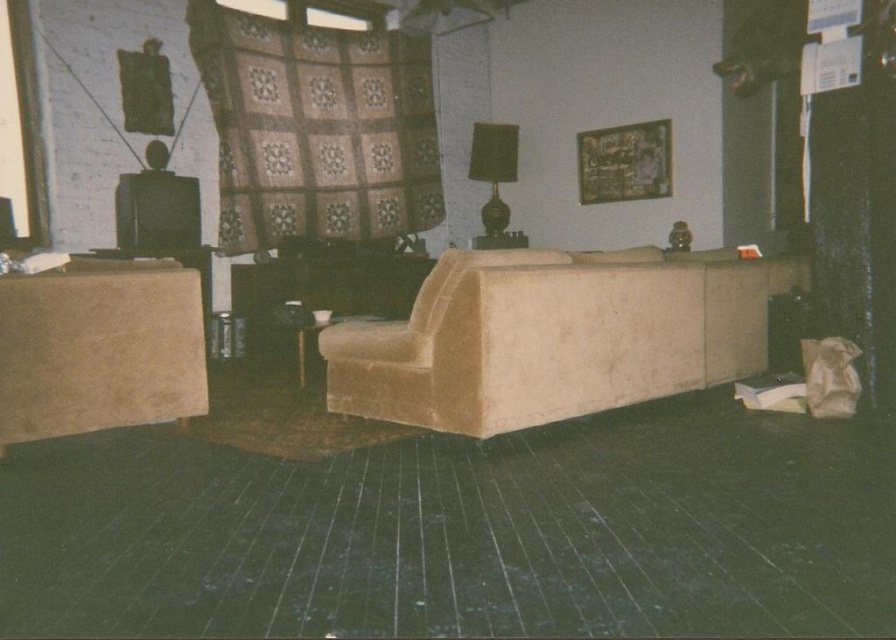
Question: Which point is farther to the camera?

Choices:
 (A) suede beige ottoman at left
 (B) beige velvety couch at center

Answer: (B)

Question: Can you confirm if beige velvety couch at center is positioned to the left of suede beige ottoman at left?

Choices:
 (A) yes
 (B) no

Answer: (B)

Question: Does beige velvety couch at center appear under suede beige ottoman at left?

Choices:
 (A) no
 (B) yes

Answer: (A)

Question: Which object appears closest to the camera in this image?

Choices:
 (A) suede beige ottoman at left
 (B) beige velvety couch at center

Answer: (A)

Question: Is beige velvety couch at center behind suede beige ottoman at left?

Choices:
 (A) yes
 (B) no

Answer: (A)